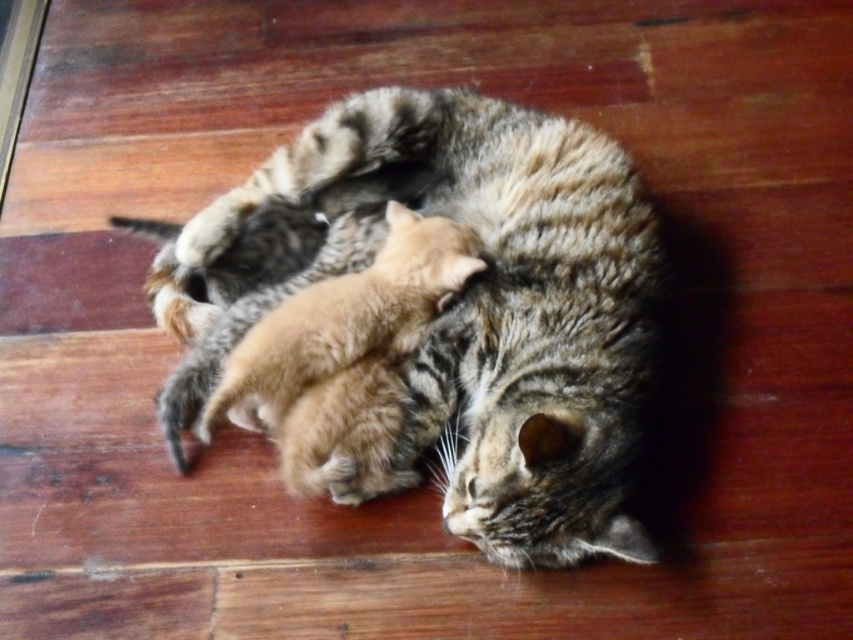
Question: Is tabby fur cat at center behind orange fur kitten at center?

Choices:
 (A) yes
 (B) no

Answer: (B)

Question: Where is tabby fur cat at center located in relation to orange fur kitten at center in the image?

Choices:
 (A) below
 (B) above

Answer: (B)

Question: Which of the following is the farthest from the observer?

Choices:
 (A) orange fur kitten at center
 (B) tabby fur cat at center

Answer: (A)

Question: Which of the following is the farthest from the observer?

Choices:
 (A) tabby fur cat at center
 (B) orange fur kitten at center

Answer: (B)

Question: Is tabby fur cat at center to the left of orange fur kitten at center from the viewer's perspective?

Choices:
 (A) yes
 (B) no

Answer: (B)